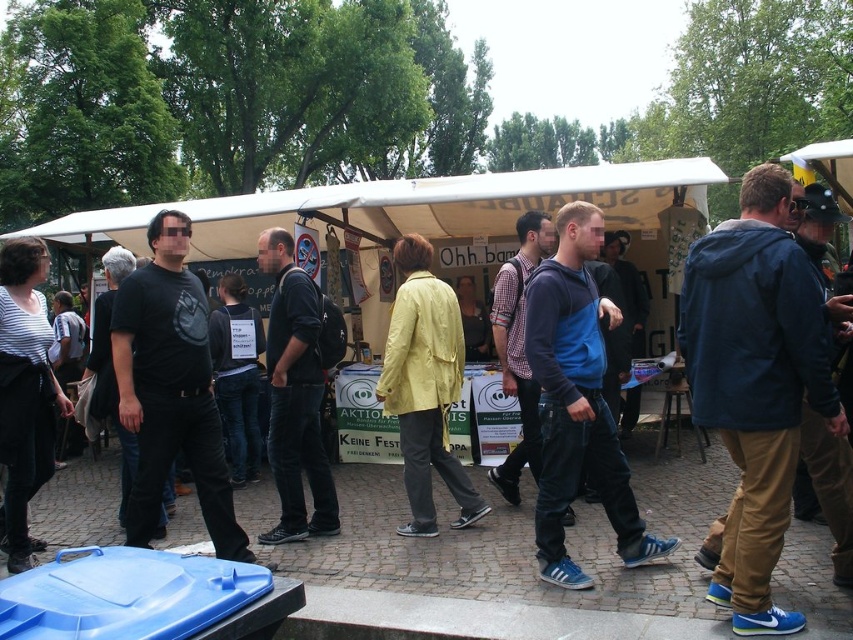
Is blue fleece jacket at center positioned behind matte blue jacket at center?

No, it is in front of matte blue jacket at center.

Find the location of a particular element. The image size is (853, 640). blue fleece jacket at center is located at coordinates (577, 401).

This screenshot has width=853, height=640. What do you see at coordinates (577, 401) in the screenshot?
I see `blue fleece jacket at center` at bounding box center [577, 401].

At what (x,y) coordinates should I click in order to perform the action: click on blue fleece jacket at center. Please return your answer as a coordinate pair (x, y). This screenshot has width=853, height=640. Looking at the image, I should click on (577, 401).

Can you confirm if matte black t-shirt at center is positioned to the right of dark blue leather jacket at center?

No, matte black t-shirt at center is not to the right of dark blue leather jacket at center.

Which is behind, point (131, 294) or point (310, 433)?

The point (310, 433) is behind.

Find the location of a particular element. Image resolution: width=853 pixels, height=640 pixels. matte black t-shirt at center is located at coordinates (170, 388).

Does blue fleece jacket at center appear over dark blue leather jacket at center?

Yes.

Who is more distant from viewer, (593, 467) or (335, 518)?

The point (335, 518) is behind.

Where is `blue fleece jacket at center`? Image resolution: width=853 pixels, height=640 pixels. blue fleece jacket at center is located at coordinates tap(577, 401).